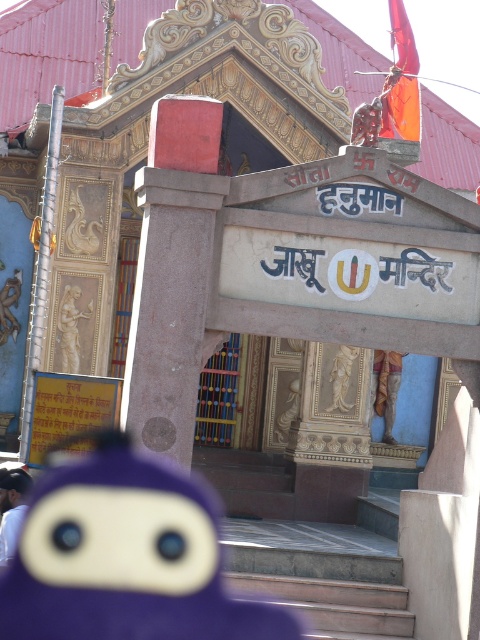
Does blue fabric cap at lower left lie behind smooth stone statue at center?

No, blue fabric cap at lower left is in front of smooth stone statue at center.

From the picture: Who is shorter, blue fabric cap at lower left or smooth stone statue at center?

blue fabric cap at lower left

Is point (11, 518) farther from camera compared to point (75, 289)?

No, (11, 518) is in front of (75, 289).

The image size is (480, 640). What are the coordinates of `blue fabric cap at lower left` in the screenshot? It's located at (12, 508).

Does point (128, 496) lie behind point (64, 348)?

No, (128, 496) is in front of (64, 348).

Does purple plush toy at center come in front of smooth stone statue at center?

Yes, it is.

Is point (120, 474) closer to viewer compared to point (81, 316)?

Yes, point (120, 474) is closer to viewer.

The width and height of the screenshot is (480, 640). I want to click on purple plush toy at center, so click(124, 556).

Is blue fabric cap at lower left to the left of carved stone statue at center from the viewer's perspective?

Correct, you'll find blue fabric cap at lower left to the left of carved stone statue at center.

Does blue fabric cap at lower left have a lesser width compared to carved stone statue at center?

Correct, blue fabric cap at lower left's width is less than carved stone statue at center's.

Which is behind, point (7, 532) or point (389, 420)?

Point (389, 420)

This screenshot has height=640, width=480. I want to click on blue fabric cap at lower left, so click(x=12, y=508).